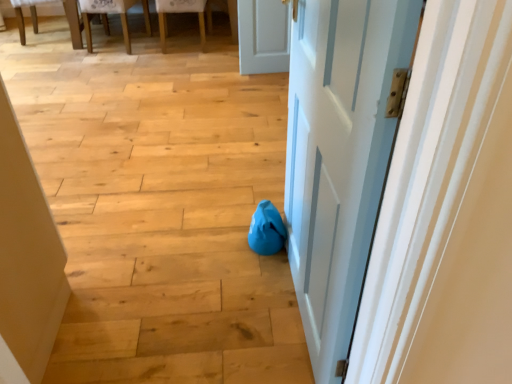
Identify the location of free spot to the left of white painted wood door at center. The height and width of the screenshot is (384, 512). (200, 299).